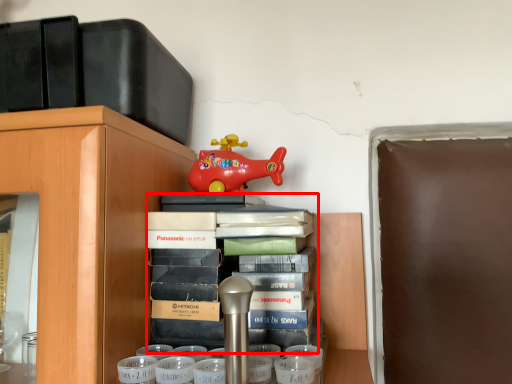
Question: From the image's perspective, considering the relative positions of book (annotated by the red box) and toy in the image provided, where is book (annotated by the red box) located with respect to the staircase?

Choices:
 (A) above
 (B) below

Answer: (B)